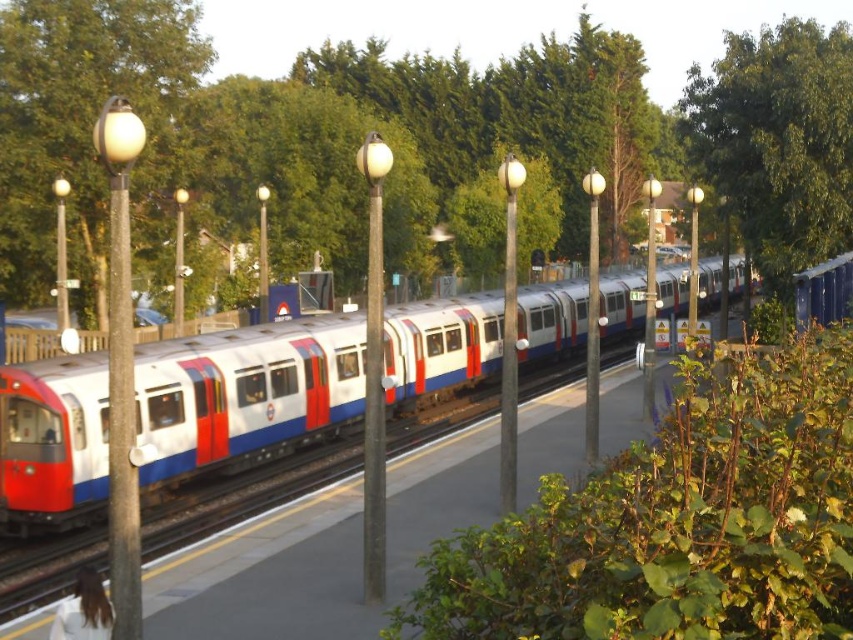
Measure the distance between point (148, 157) and camera.

Point (148, 157) and camera are 75.54 feet apart from each other.

From the picture: Who is more distant from viewer, (27,44) or (137,396)?

The point (27,44) is more distant.

Find the location of a particular element. green leafy tree at center is located at coordinates (408, 141).

Can you confirm if green leafy tree at upper left is positioned above green leafy tree at upper right?

No, green leafy tree at upper left is not above green leafy tree at upper right.

Between green leafy tree at upper left and green leafy tree at upper right, which one appears on the left side from the viewer's perspective?

Positioned to the left is green leafy tree at upper left.

Which is in front, point (36, 58) or point (732, 113)?

Point (36, 58) is more forward.

You are a GUI agent. You are given a task and a screenshot of the screen. Output one action in this format:
    pyautogui.click(x=<x>, y=<y>)
    Task: Click on the green leafy tree at upper left
    This screenshot has width=853, height=640.
    Given the screenshot: What is the action you would take?
    pyautogui.click(x=85, y=125)

Measure the distance between point (28,515) and camera.

Point (28,515) and camera are 43.11 feet apart.

Between matte white train at center and green leafy tree at upper left, which one appears on the left side from the viewer's perspective?

From the viewer's perspective, green leafy tree at upper left appears more on the left side.

Who is more distant from viewer, [276,368] or [103,317]?

The point [103,317] is behind.

You are a GUI agent. You are given a task and a screenshot of the screen. Output one action in this format:
    pyautogui.click(x=<x>, y=<y>)
    Task: Click on the matte white train at center
    The image size is (853, 640).
    Given the screenshot: What is the action you would take?
    pyautogui.click(x=245, y=394)